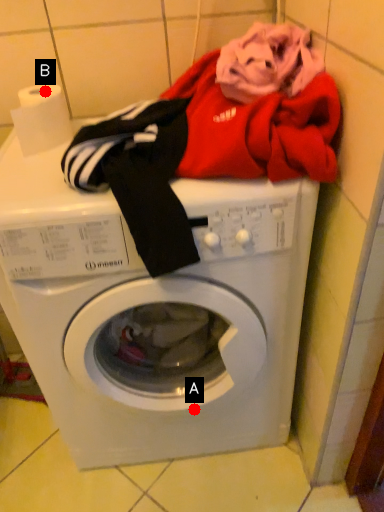
Question: Two points are circled on the image, labeled by A and B beside each circle. Which point is farther from the camera taking this photo?

Choices:
 (A) A is further
 (B) B is further

Answer: (A)